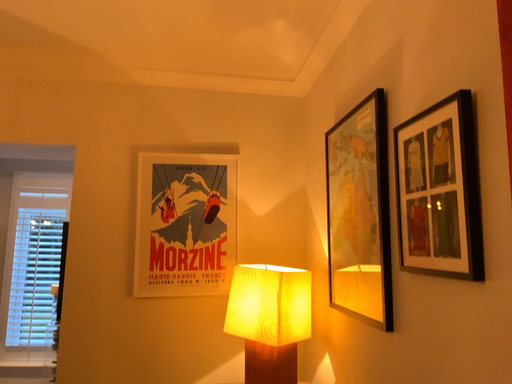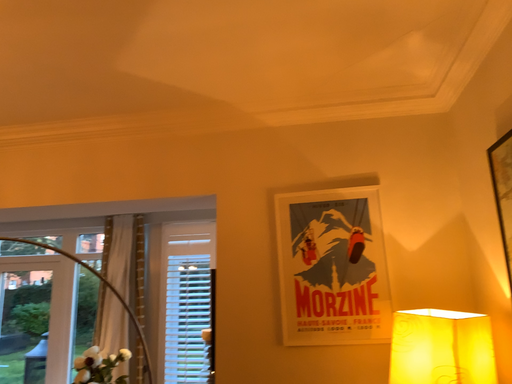
Question: How did the camera likely rotate when shooting the video?

Choices:
 (A) rotated right
 (B) rotated left

Answer: (B)